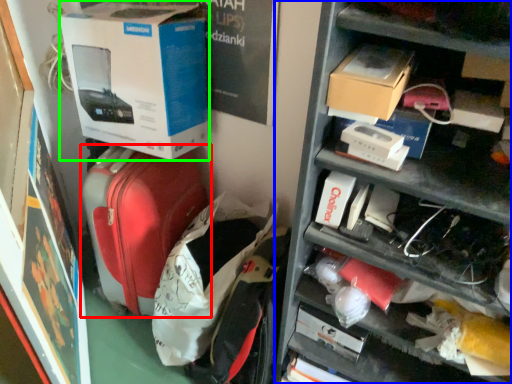
Question: Based on their relative distances, which object is nearer to suitcase (highlighted by a red box)? Choose from shelf (highlighted by a blue box) and box (highlighted by a green box).

Choices:
 (A) shelf
 (B) box

Answer: (B)